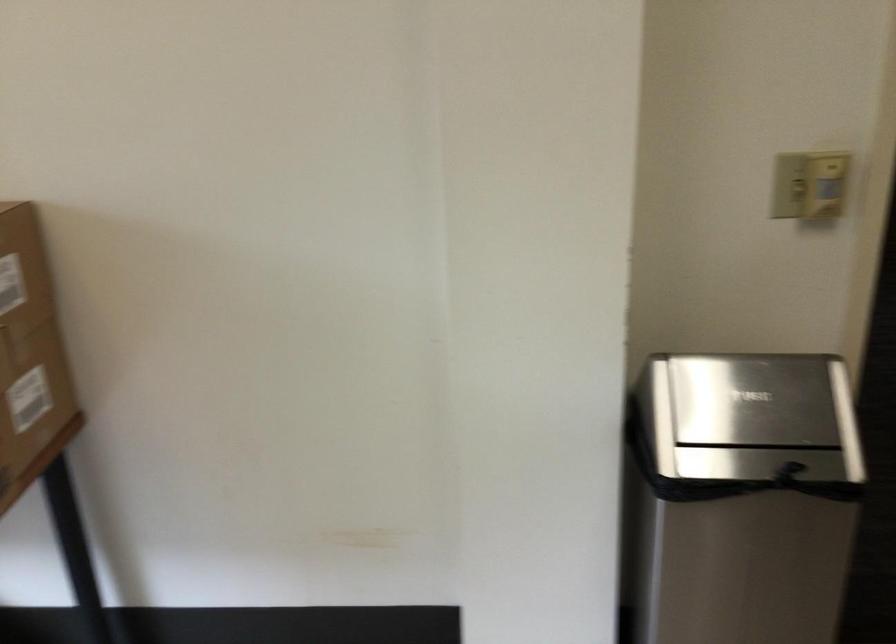
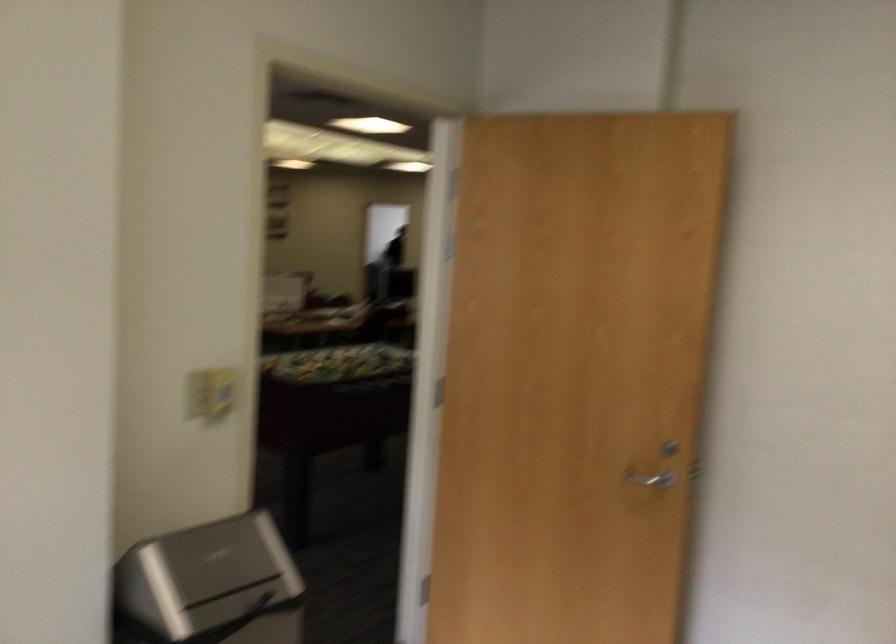
Question: I am providing you with two images of the same scene from different viewpoints. After the viewpoint changes to image2, which objects are now occluded?

Choices:
 (A) silver door handle
 (B) light switch
 (C) small silver speaker
 (D) none of these

Answer: (D)